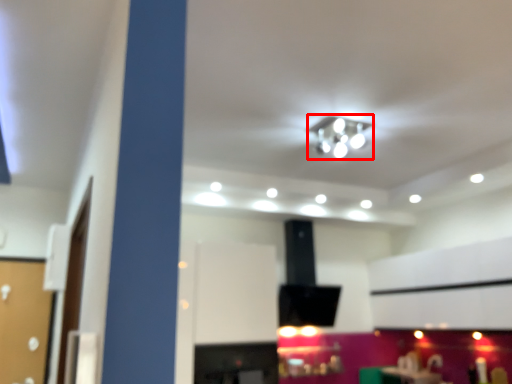
Question: From the image, what is the correct spatial relationship of lamp (annotated by the red box) in relation to table?

Choices:
 (A) right
 (B) left

Answer: (B)